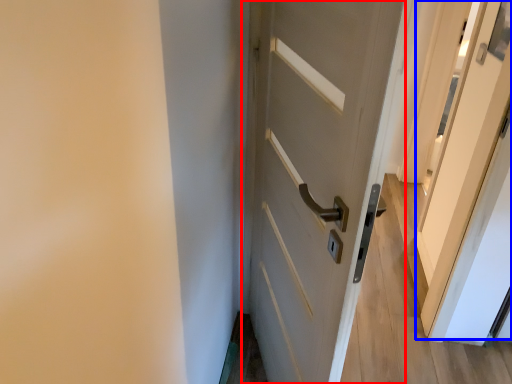
Question: Which object appears closest to the camera in this image, door (highlighted by a red box) or screen door (highlighted by a blue box)?

Choices:
 (A) door
 (B) screen door

Answer: (A)